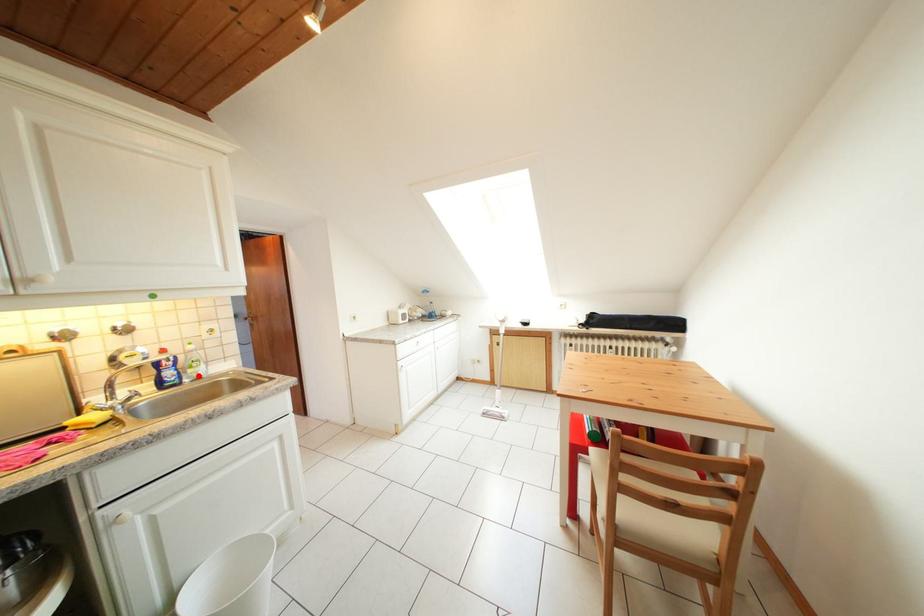
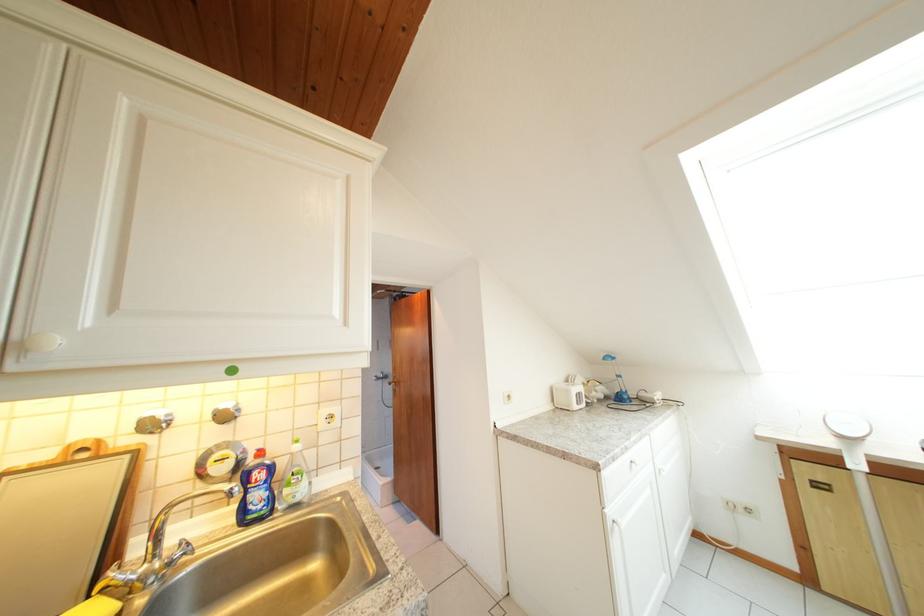
In the second image, find the point that corresponds to the highlighted location in the first image.

(295, 496)